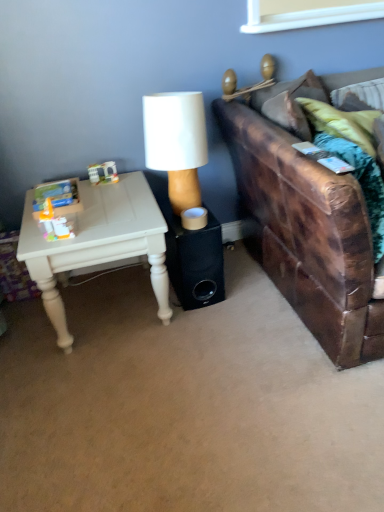
You are a GUI agent. You are given a task and a screenshot of the screen. Output one action in this format:
    pyautogui.click(x=<x>, y=<y>)
    Task: Click on the free spot below white painted wood table at left (from a real-world perspective)
    The width and height of the screenshot is (384, 512).
    Given the screenshot: What is the action you would take?
    pyautogui.click(x=110, y=305)